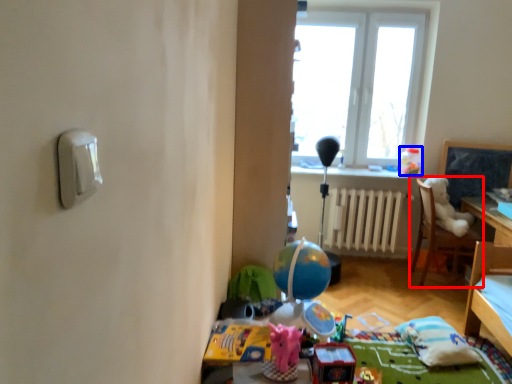
Question: Which object appears farthest to the camera in this image, chair (highlighted by a red box) or toy (highlighted by a blue box)?

Choices:
 (A) chair
 (B) toy

Answer: (B)